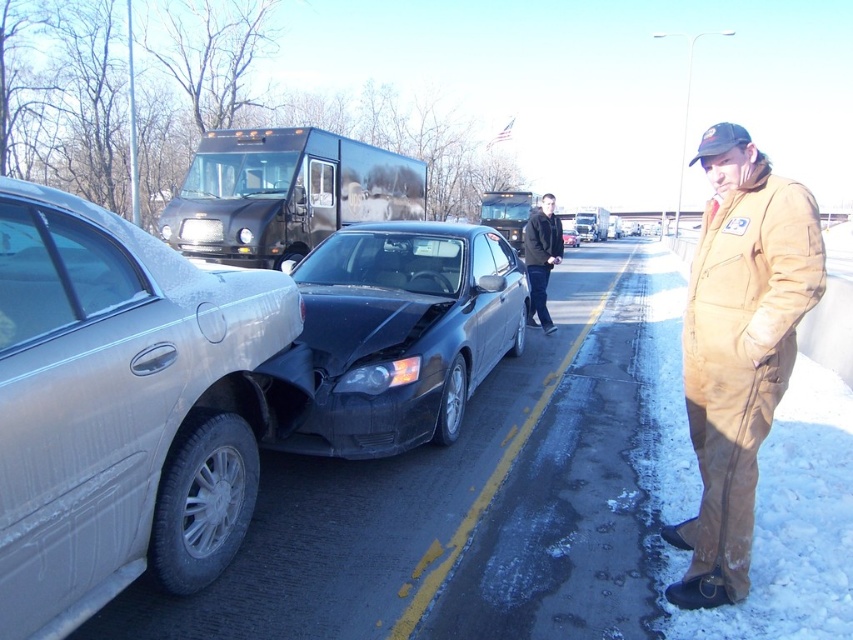
Who is positioned more to the left, satin silver sedan at left or dark blue jacket at center?

satin silver sedan at left is more to the left.

The height and width of the screenshot is (640, 853). I want to click on satin silver sedan at left, so click(120, 406).

Identify the location of brown corduroy jumpsuit at right. This screenshot has width=853, height=640. (738, 348).

Image resolution: width=853 pixels, height=640 pixels. What do you see at coordinates (738, 348) in the screenshot?
I see `brown corduroy jumpsuit at right` at bounding box center [738, 348].

At what (x,y) coordinates should I click in order to perform the action: click on brown corduroy jumpsuit at right. Please return your answer as a coordinate pair (x, y). The height and width of the screenshot is (640, 853). Looking at the image, I should click on (738, 348).

Locate an element on the screen. brown corduroy jumpsuit at right is located at coordinates (738, 348).

Looking at this image, is satin silver sedan at left bigger than black matte car at center?

No, satin silver sedan at left is not bigger than black matte car at center.

Is satin silver sedan at left below black matte car at center?

Correct, satin silver sedan at left is located below black matte car at center.

Between point (155, 372) and point (381, 269), which one is positioned behind?

The point (381, 269) is more distant.

What are the coordinates of `satin silver sedan at left` in the screenshot? It's located at (120, 406).